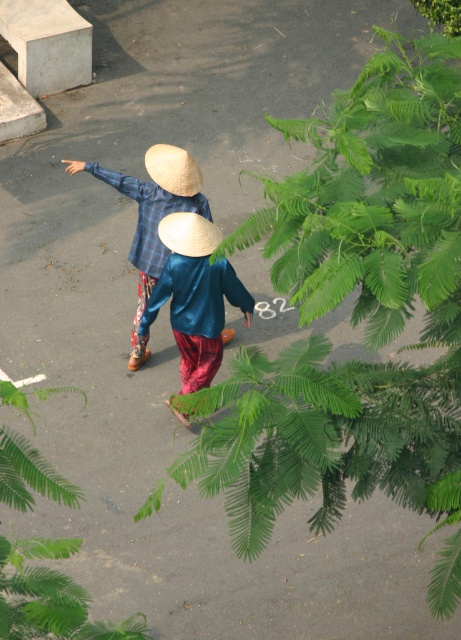
Question: Which object appears closest to the camera in this image?

Choices:
 (A) green leafy fern at lower left
 (B) natural straw hat at upper center
 (C) green leafy fern at upper right
 (D) blue plaid shirt at center

Answer: (C)

Question: Does green leafy fern at lower left have a larger size compared to blue plaid shirt at center?

Choices:
 (A) no
 (B) yes

Answer: (A)

Question: Does blue silk shirt at center have a lesser width compared to natural straw hat at upper center?

Choices:
 (A) yes
 (B) no

Answer: (B)

Question: Does blue plaid shirt at center appear on the left side of natural straw hat at upper center?

Choices:
 (A) no
 (B) yes

Answer: (B)

Question: Which point is closer to the camera?

Choices:
 (A) (187, 298)
 (B) (17, 490)
 (C) (100, 168)

Answer: (B)

Question: Considering the real-world distances, which object is farthest from the green leafy fern at lower left?

Choices:
 (A) natural straw hat at center
 (B) natural straw hat at upper center
 (C) green leafy fern at upper right
 (D) blue plaid shirt at center

Answer: (B)